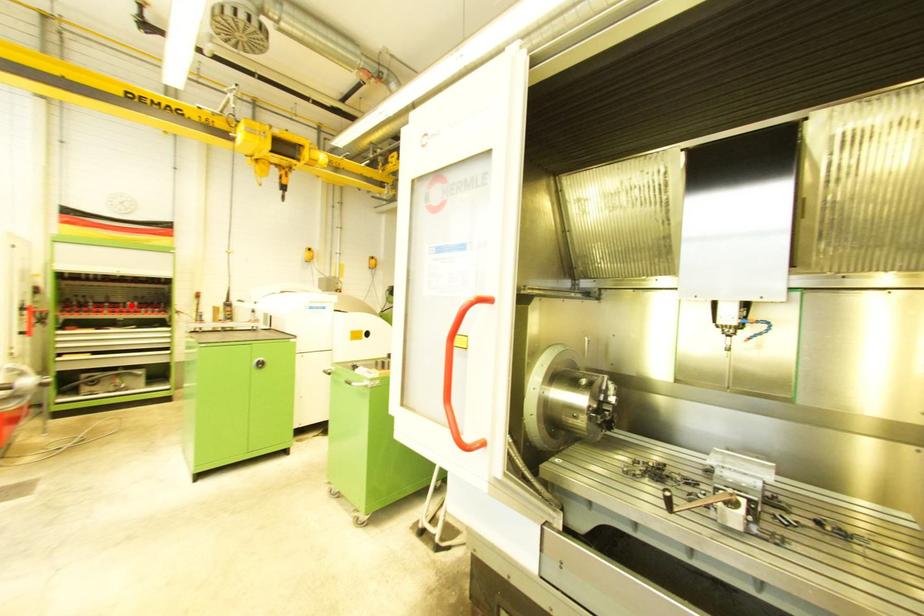
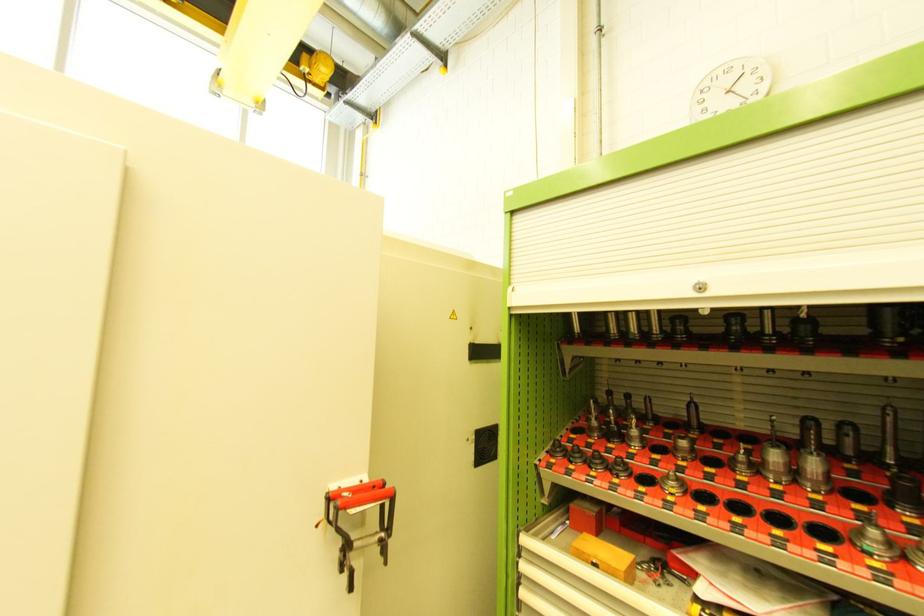
The point at the highlighted location is marked in the first image. Where is the corresponding point in the second image?

(777, 458)